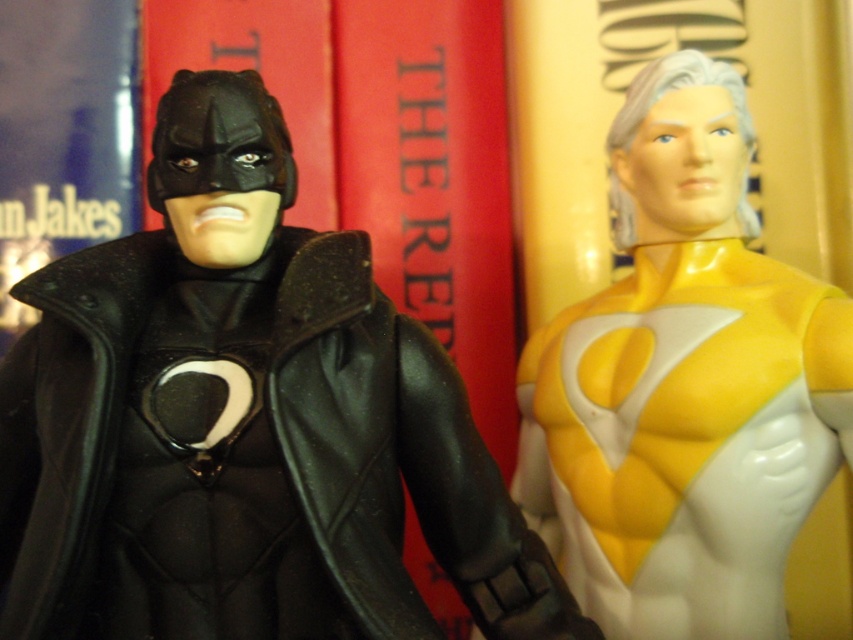
Question: Among these objects, which one is farthest from the camera?

Choices:
 (A) yellow matte/silky fabric at center
 (B) matte black suit at left

Answer: (A)

Question: Does matte black suit at left lie behind yellow matte/silky fabric at center?

Choices:
 (A) yes
 (B) no

Answer: (B)

Question: Which object is closer to the camera taking this photo?

Choices:
 (A) yellow matte/silky fabric at center
 (B) matte black suit at left

Answer: (B)

Question: Does matte black suit at left appear on the left side of yellow matte/silky fabric at center?

Choices:
 (A) no
 (B) yes

Answer: (B)

Question: From the image, what is the correct spatial relationship of matte black suit at left in relation to yellow matte/silky fabric at center?

Choices:
 (A) right
 (B) left

Answer: (B)

Question: Among these objects, which one is nearest to the camera?

Choices:
 (A) yellow matte/silky fabric at center
 (B) matte black suit at left

Answer: (B)